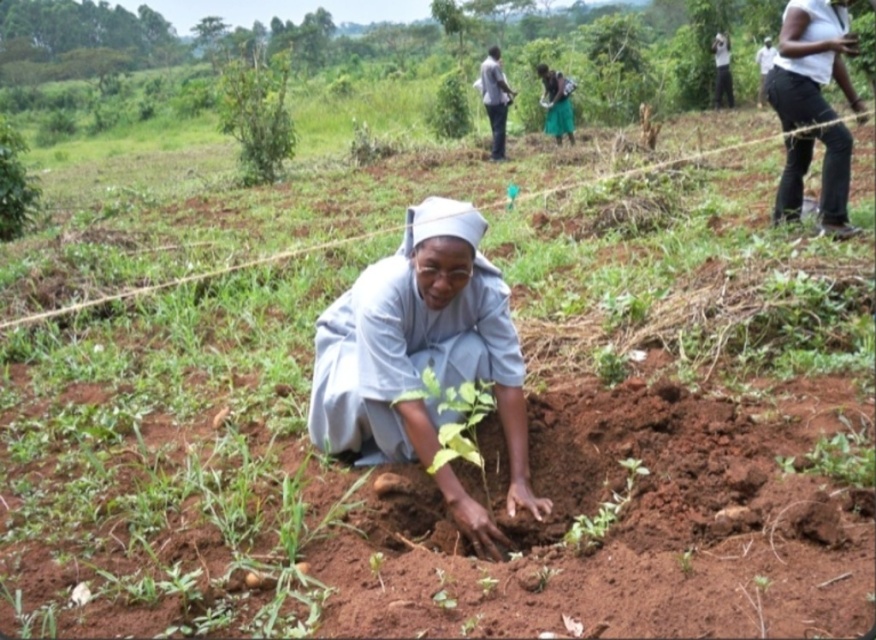
How much distance is there between green leafy plant at center and green fabric dress at upper center?

A distance of 39.32 feet exists between green leafy plant at center and green fabric dress at upper center.

Can you confirm if green leafy plant at center is shorter than green fabric dress at upper center?

Indeed, green leafy plant at center has a lesser height compared to green fabric dress at upper center.

Between point (415, 390) and point (542, 93), which one is positioned behind?

Positioned behind is point (542, 93).

I want to click on green leafy plant at center, so click(x=456, y=420).

This screenshot has width=876, height=640. Find the location of `light gray fabric at center`. light gray fabric at center is located at coordinates (420, 348).

Can you confirm if light gray fabric at center is shorter than green fabric dress at upper center?

Correct, light gray fabric at center is not as tall as green fabric dress at upper center.

Locate an element on the screen. light gray fabric at center is located at coordinates (420, 348).

Does green fabric dress at upper center have a greater width compared to white clothed person at upper right?

Yes.

Locate an element on the screen. Image resolution: width=876 pixels, height=640 pixels. green fabric dress at upper center is located at coordinates (556, 104).

Image resolution: width=876 pixels, height=640 pixels. Find the location of `green fabric dress at upper center`. green fabric dress at upper center is located at coordinates (556, 104).